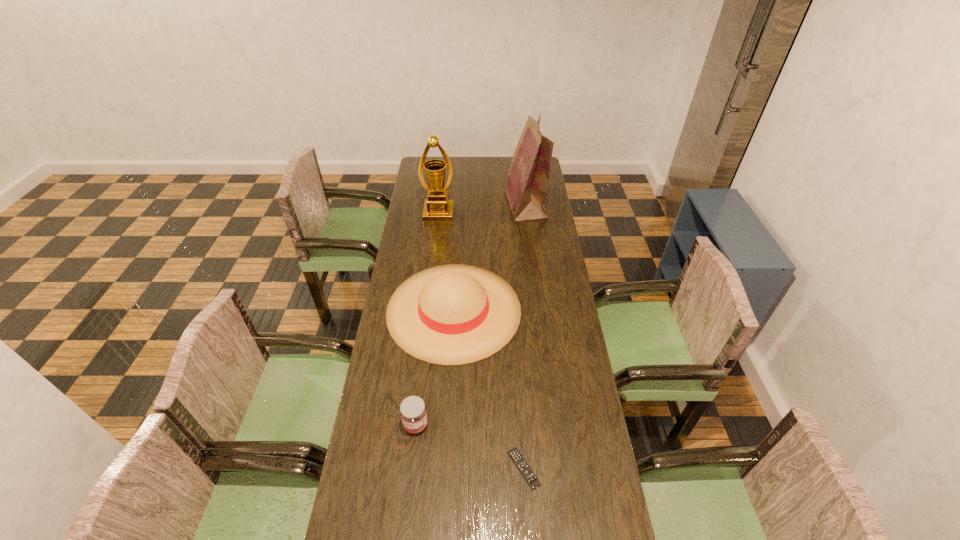
Locate an element on the screen. Image resolution: width=960 pixels, height=540 pixels. free location that satisfies the following two spatial constraints: 1. on the front-facing side of the award; 2. on the right side of the third nearest object is located at coordinates (428, 310).